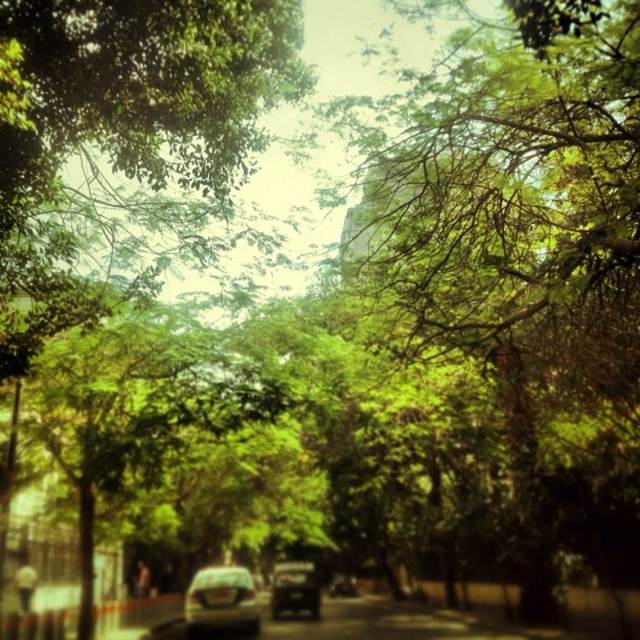
Question: Considering the real-world distances, which object is farthest from the shiny black car at center?

Choices:
 (A) matte silver car at center
 (B) shiny silver car at center

Answer: (A)

Question: Which of the following is the farthest from the observer?

Choices:
 (A) matte silver car at center
 (B) shiny silver car at center

Answer: (B)

Question: Is matte silver car at center to the left of shiny silver car at center from the viewer's perspective?

Choices:
 (A) yes
 (B) no

Answer: (A)

Question: Is the position of matte silver car at center less distant than that of shiny silver car at center?

Choices:
 (A) no
 (B) yes

Answer: (B)

Question: Is matte silver car at center to the right of shiny black car at center from the viewer's perspective?

Choices:
 (A) yes
 (B) no

Answer: (B)

Question: Estimate the real-world distances between objects in this image. Which object is closer to the shiny black car at center?

Choices:
 (A) matte silver car at center
 (B) shiny silver car at center

Answer: (B)